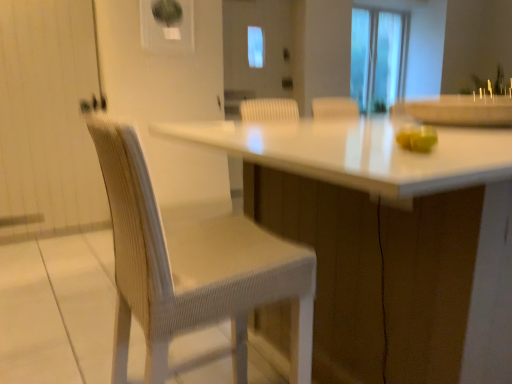
Question: Considering the relative sizes of green matte apple at right and white glossy table at center in the image provided, is green matte apple at right shorter than white glossy table at center?

Choices:
 (A) yes
 (B) no

Answer: (A)

Question: Does green matte apple at right come behind white glossy table at center?

Choices:
 (A) yes
 (B) no

Answer: (A)

Question: From the image's perspective, does green matte apple at right appear lower than white glossy table at center?

Choices:
 (A) no
 (B) yes

Answer: (A)

Question: Is green matte apple at right positioned beyond the bounds of white glossy table at center?

Choices:
 (A) no
 (B) yes

Answer: (B)

Question: Does green matte apple at right have a lesser width compared to white glossy table at center?

Choices:
 (A) no
 (B) yes

Answer: (B)

Question: Is green matte apple at right in front of or behind white glossy table at center in the image?

Choices:
 (A) front
 (B) behind

Answer: (B)

Question: Is green matte apple at right bigger or smaller than white glossy table at center?

Choices:
 (A) big
 (B) small

Answer: (B)

Question: Is green matte apple at right taller or shorter than white glossy table at center?

Choices:
 (A) tall
 (B) short

Answer: (B)

Question: Which is correct: green matte apple at right is inside white glossy table at center, or outside of it?

Choices:
 (A) inside
 (B) outside

Answer: (B)

Question: Considering the positions of white glossy table at center and transparent glass screen door at center in the image, is white glossy table at center taller or shorter than transparent glass screen door at center?

Choices:
 (A) tall
 (B) short

Answer: (B)

Question: Considering the positions of white glossy table at center and transparent glass screen door at center in the image, is white glossy table at center wider or thinner than transparent glass screen door at center?

Choices:
 (A) thin
 (B) wide

Answer: (B)

Question: Visually, is white glossy table at center positioned to the left or to the right of transparent glass screen door at center?

Choices:
 (A) right
 (B) left

Answer: (A)

Question: From the image's perspective, relative to transparent glass screen door at center, is white glossy table at center above or below?

Choices:
 (A) below
 (B) above

Answer: (A)

Question: In terms of size, does transparent glass screen door at center appear bigger or smaller than green matte apple at right?

Choices:
 (A) big
 (B) small

Answer: (A)

Question: From the image's perspective, is transparent glass screen door at center positioned above or below green matte apple at right?

Choices:
 (A) below
 (B) above

Answer: (B)